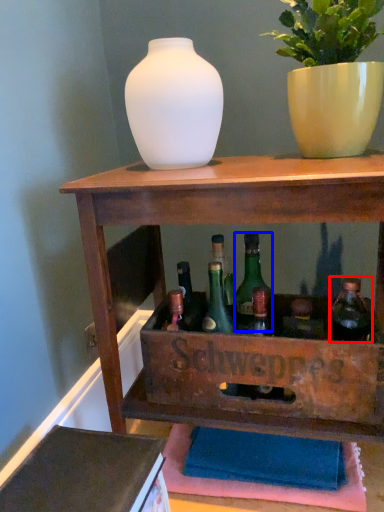
Question: Which object is closer to the camera taking this photo, bottle (highlighted by a red box) or glass bottle (highlighted by a blue box)?

Choices:
 (A) bottle
 (B) glass bottle

Answer: (A)